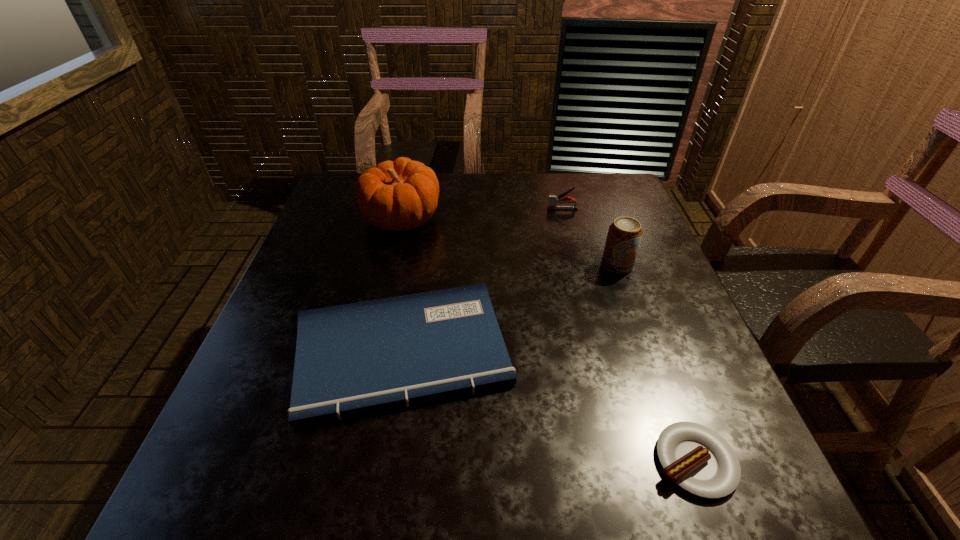
The image size is (960, 540). In order to click on vacant point that satisfies the following two spatial constraints: 1. on the front side of the sausage; 2. on the right side of the paperback book in this screenshot , I will do coord(384,461).

The width and height of the screenshot is (960, 540). Find the location of `vacant area that satisfies the following two spatial constraints: 1. on the front side of the second tallest object; 2. on the right side of the sausage`. vacant area that satisfies the following two spatial constraints: 1. on the front side of the second tallest object; 2. on the right side of the sausage is located at coordinates (685, 461).